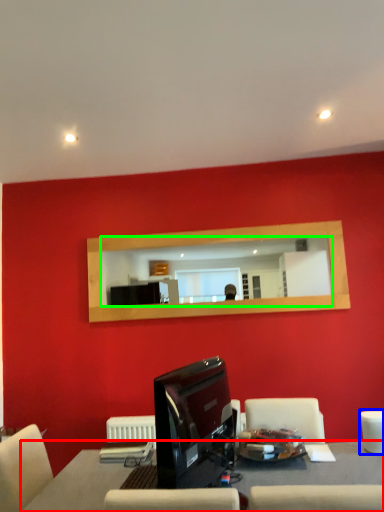
Question: Based on their relative distances, which object is nearer to table (highlighted by a red box)? Choose from armchair (highlighted by a blue box) and mirror (highlighted by a green box).

Choices:
 (A) armchair
 (B) mirror

Answer: (A)